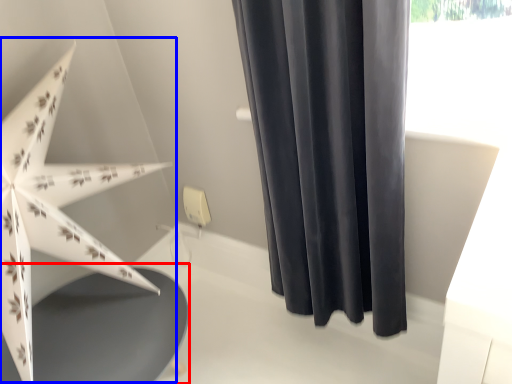
Question: Which object appears closest to the camera in this image, round table (highlighted by a red box) or umbrella (highlighted by a blue box)?

Choices:
 (A) round table
 (B) umbrella

Answer: (B)